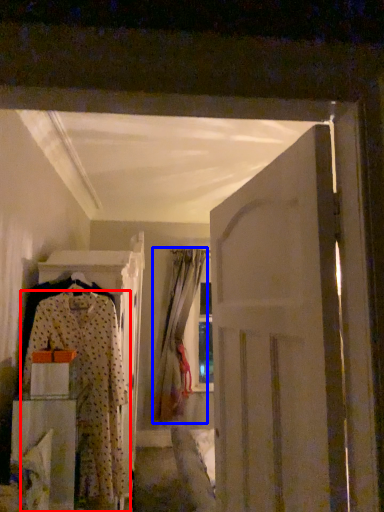
Question: Among these objects, which one is nearest to the camera, fancy dress (highlighted by a red box) or curtain (highlighted by a blue box)?

Choices:
 (A) fancy dress
 (B) curtain

Answer: (A)